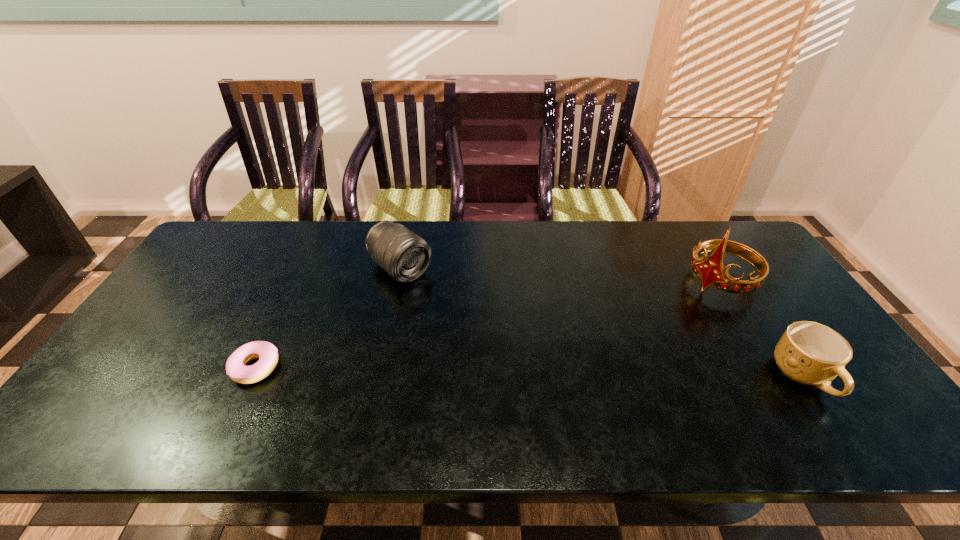
Locate an element on the screen. free space between the tallest object and the third tallest object is located at coordinates (762, 329).

Where is `free space between the tallest object and the second tallest object`? Image resolution: width=960 pixels, height=540 pixels. free space between the tallest object and the second tallest object is located at coordinates (560, 275).

In order to click on blank region between the tiara and the third tallest object in this screenshot , I will do `click(762, 329)`.

In order to click on free space between the tallest object and the second tallest object in this screenshot , I will do `click(560, 275)`.

At what (x,y) coordinates should I click in order to perform the action: click on empty space that is in between the tiara and the third object from right to left. Please return your answer as a coordinate pair (x, y). This screenshot has height=540, width=960. Looking at the image, I should click on (560, 275).

This screenshot has height=540, width=960. I want to click on vacant area that lies between the third tallest object and the telephoto lens, so click(x=602, y=322).

Image resolution: width=960 pixels, height=540 pixels. In order to click on object that is the third closest to the third shortest object in this screenshot , I will do `click(810, 353)`.

Identify which object is the second closest to the second tallest object. Please provide its 2D coordinates. Your answer should be formatted as a tuple, i.e. [(x, y)], where the tuple contains the x and y coordinates of a point satisfying the conditions above.

[(710, 271)]

Find the location of `vacant point that satisfies the following two spatial constraints: 1. on the back side of the third shortest object; 2. on the left side of the doughnut`. vacant point that satisfies the following two spatial constraints: 1. on the back side of the third shortest object; 2. on the left side of the doughnut is located at coordinates (301, 268).

Where is `free space that satisfies the following two spatial constraints: 1. on the front side of the tallest object; 2. on the right side of the second object from left to right`? free space that satisfies the following two spatial constraints: 1. on the front side of the tallest object; 2. on the right side of the second object from left to right is located at coordinates (397, 282).